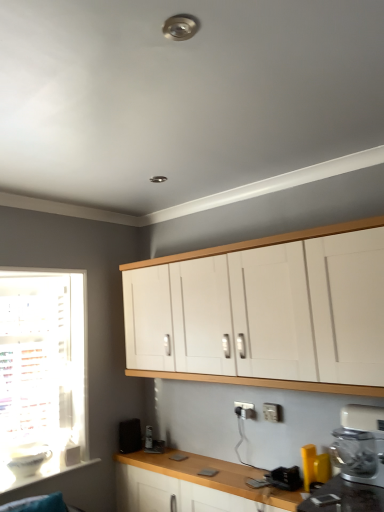
Find the location of `vacant area situated to the left side of metallic silver toaster at lower center, which ranks as the second appliance in left-to-right order`. vacant area situated to the left side of metallic silver toaster at lower center, which ranks as the second appliance in left-to-right order is located at coordinates (262, 483).